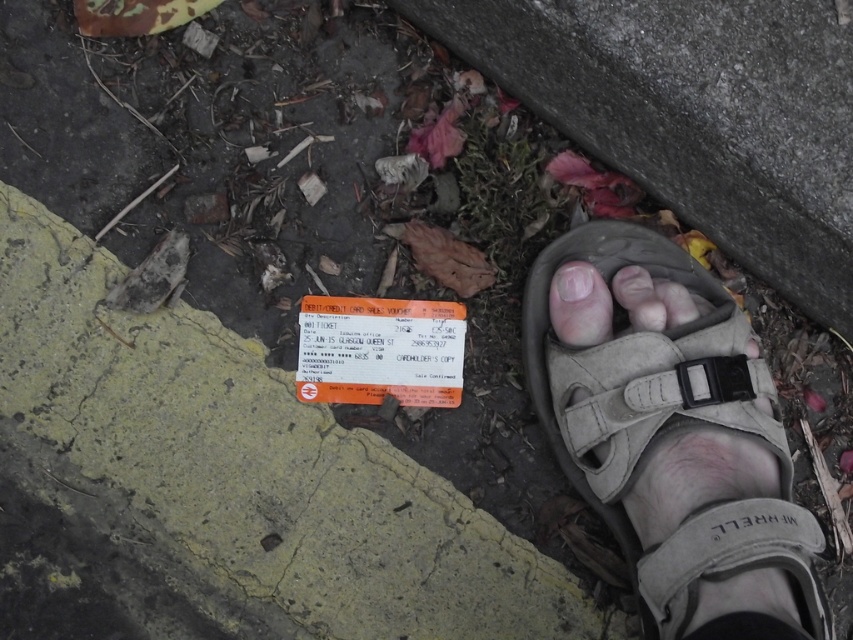
Question: Which of the following is the closest to the observer?

Choices:
 (A) pale skin toe at center
 (B) pink flesh at center
 (C) tan suede sandal at lower right

Answer: (C)

Question: Which point is closer to the camera?

Choices:
 (A) (560, 320)
 (B) (587, 275)
 (C) (697, 554)

Answer: (C)

Question: Does tan suede sandal at lower right have a greater width compared to pink flesh at center?

Choices:
 (A) no
 (B) yes

Answer: (B)

Question: Can you confirm if tan suede sandal at lower right is wider than pale skin toe at center?

Choices:
 (A) yes
 (B) no

Answer: (A)

Question: Is tan suede sandal at lower right above pale skin toe at center?

Choices:
 (A) no
 (B) yes

Answer: (A)

Question: Based on their relative distances, which object is nearer to the pink flesh at center?

Choices:
 (A) pale skin toe at center
 (B) tan suede sandal at lower right

Answer: (A)